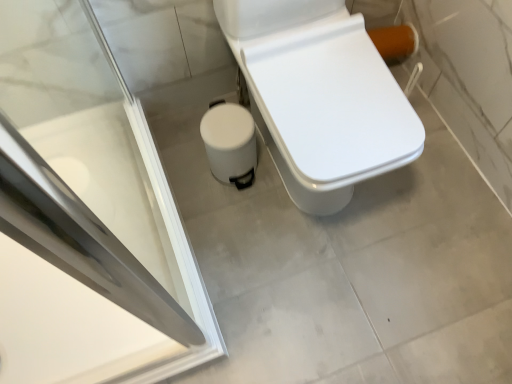
Question: Considering the positions of white matte trash can at lower center and white glossy toilet at center in the image, is white matte trash can at lower center wider or thinner than white glossy toilet at center?

Choices:
 (A) thin
 (B) wide

Answer: (A)

Question: From the image's perspective, relative to white glossy toilet at center, is white matte trash can at lower center above or below?

Choices:
 (A) above
 (B) below

Answer: (B)

Question: Based on their relative distances, which object is farther from the white matte trash can at lower center?

Choices:
 (A) white glossy toilet at center
 (B) transparent glass screen door at upper left

Answer: (B)

Question: Which object is positioned farthest from the white matte trash can at lower center?

Choices:
 (A) white glossy toilet at center
 (B) transparent glass screen door at upper left

Answer: (B)